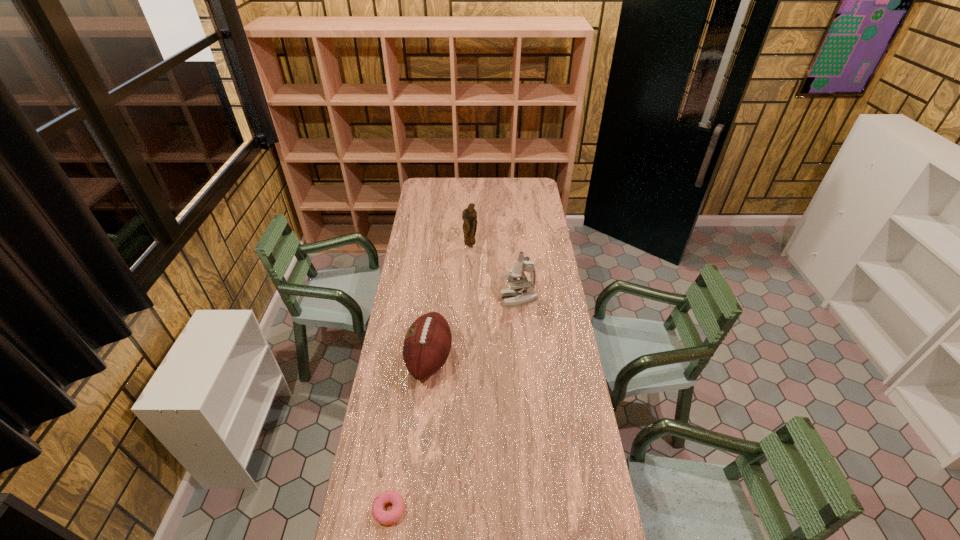
Find the location of `free space located 0.390m on the right of the third farthest object`. free space located 0.390m on the right of the third farthest object is located at coordinates (545, 359).

Where is `vacant space situated on the back of the nearest object`? vacant space situated on the back of the nearest object is located at coordinates (406, 394).

The image size is (960, 540). I want to click on football (American) at the left edge, so click(427, 343).

Identify the location of doughnut that is at the left edge. (383, 517).

Image resolution: width=960 pixels, height=540 pixels. What are the coordinates of `object positioned at the right edge` in the screenshot? It's located at (522, 291).

Identify the location of vacant space at the far edge. (472, 195).

Identify the location of free space at the left edge of the desktop. This screenshot has width=960, height=540. (371, 463).

The width and height of the screenshot is (960, 540). I want to click on free space at the right edge of the desktop, so click(547, 417).

Where is `blank space at the far left corner of the desktop`? This screenshot has height=540, width=960. blank space at the far left corner of the desktop is located at coordinates (427, 180).

Find the location of a particular element. vacant area between the microscope and the third tallest object is located at coordinates (474, 329).